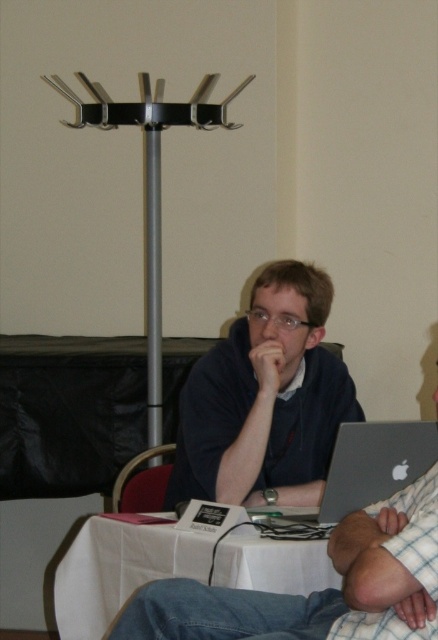
Question: Based on their relative distances, which object is nearer to the matte black laptop at center?

Choices:
 (A) red fabric chair at lower left
 (B) matte black shirt at center
 (C) silver metallic laptop at center

Answer: (C)

Question: Is white cloth table at center smaller than silver metallic laptop at center?

Choices:
 (A) no
 (B) yes

Answer: (A)

Question: Can you confirm if silver metallic laptop at center is positioned to the right of red fabric chair at lower left?

Choices:
 (A) no
 (B) yes

Answer: (B)

Question: Which is nearer to the matte black shirt at center?

Choices:
 (A) silver metallic laptop at center
 (B) matte black laptop at center

Answer: (A)

Question: Which point is farther to the camera?

Choices:
 (A) (399, 616)
 (B) (300, 500)
 (C) (315, 564)

Answer: (B)

Question: Observing the image, what is the correct spatial positioning of white cloth table at center in reference to red fabric chair at lower left?

Choices:
 (A) left
 (B) right

Answer: (B)